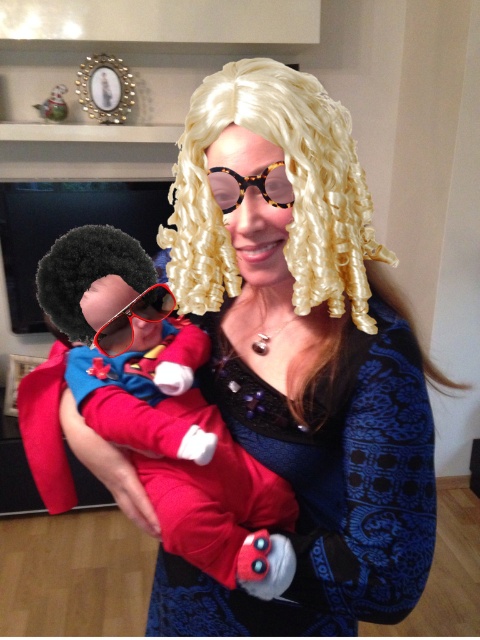
Consider the image. You are a costume designer preparing for a performance. You have two items to place on a mannequin. The matte black wig at center and the red fabric costume at left. Which item should you place first if you want to ensure the larger item is positioned correctly before the smaller one?

The matte black wig at center should be placed first because it has a larger size compared to the red fabric costume at left, ensuring proper positioning before the smaller item.

You are a costume designer trying to decide which accessory to place on the person in the image. You have the red plastic goggles at center and the tortoiseshell sunglasses at center. If you want to choose the bigger accessory, which one should you pick?

The red plastic goggles at center is larger in size than the tortoiseshell sunglasses at center, so you should pick the red plastic goggles at center.